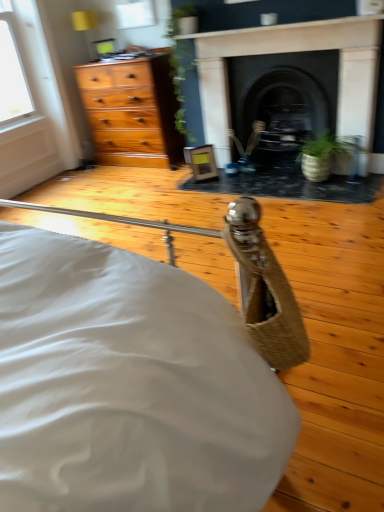
Question: Does dark stone fireplace at center, the 2th fireplace positioned from the right, touch transparent glass window at upper center?

Choices:
 (A) yes
 (B) no

Answer: (B)

Question: Is transparent glass window at upper center at the back of dark stone fireplace at center, marked as the first fireplace in a left-to-right arrangement?

Choices:
 (A) yes
 (B) no

Answer: (B)

Question: Is dark stone fireplace at center, the 2th fireplace positioned from the right, behind transparent glass window at upper center?

Choices:
 (A) no
 (B) yes

Answer: (A)

Question: Considering the relative sizes of dark stone fireplace at center, the 2th fireplace positioned from the right, and transparent glass window at upper center in the image provided, is dark stone fireplace at center, the 2th fireplace positioned from the right, thinner than transparent glass window at upper center?

Choices:
 (A) yes
 (B) no

Answer: (B)

Question: Is dark stone fireplace at center, the 2th fireplace positioned from the right, aimed at transparent glass window at upper center?

Choices:
 (A) no
 (B) yes

Answer: (A)

Question: Visually, is black stone fireplace at center, which appears as the first fireplace when viewed from the right, positioned to the left or to the right of transparent glass window at upper center?

Choices:
 (A) right
 (B) left

Answer: (A)

Question: Which is correct: black stone fireplace at center, which is the second fireplace in left-to-right order, is inside transparent glass window at upper center, or outside of it?

Choices:
 (A) inside
 (B) outside

Answer: (B)

Question: From their relative heights in the image, would you say black stone fireplace at center, which is the second fireplace in left-to-right order, is taller or shorter than transparent glass window at upper center?

Choices:
 (A) short
 (B) tall

Answer: (B)

Question: From a real-world perspective, is black stone fireplace at center, which is the second fireplace in left-to-right order, above or below transparent glass window at upper center?

Choices:
 (A) below
 (B) above

Answer: (A)

Question: Considering their positions, is dark stone fireplace at center, the 2th fireplace positioned from the right, located in front of or behind transparent glass window at upper center?

Choices:
 (A) behind
 (B) front

Answer: (B)

Question: Visually, is dark stone fireplace at center, marked as the first fireplace in a left-to-right arrangement, positioned to the left or to the right of transparent glass window at upper center?

Choices:
 (A) right
 (B) left

Answer: (A)

Question: Considering the positions of dark stone fireplace at center, marked as the first fireplace in a left-to-right arrangement, and transparent glass window at upper center in the image, is dark stone fireplace at center, marked as the first fireplace in a left-to-right arrangement, wider or thinner than transparent glass window at upper center?

Choices:
 (A) wide
 (B) thin

Answer: (A)

Question: Considering the positions of dark stone fireplace at center, the 2th fireplace positioned from the right, and transparent glass window at upper center in the image, is dark stone fireplace at center, the 2th fireplace positioned from the right, taller or shorter than transparent glass window at upper center?

Choices:
 (A) short
 (B) tall

Answer: (B)

Question: From a real-world perspective, is green textured pot at center physically located above or below transparent glass window at upper center?

Choices:
 (A) below
 (B) above

Answer: (A)

Question: Looking at the image, does green textured pot at center seem bigger or smaller compared to transparent glass window at upper center?

Choices:
 (A) small
 (B) big

Answer: (B)